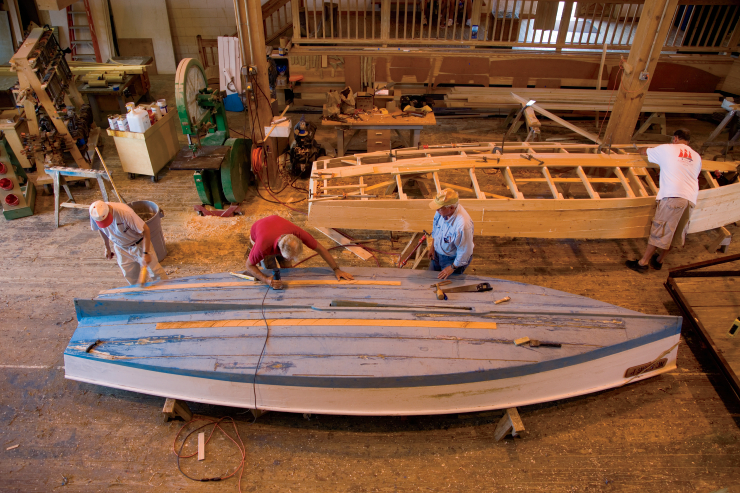
You are a GUI agent. You are given a task and a screenshot of the screen. Output one action in this format:
    pyautogui.click(x=<x>, y=<y>)
    Task: Click on the floor
    
    Given the screenshot: What is the action you would take?
    pyautogui.click(x=460, y=481)